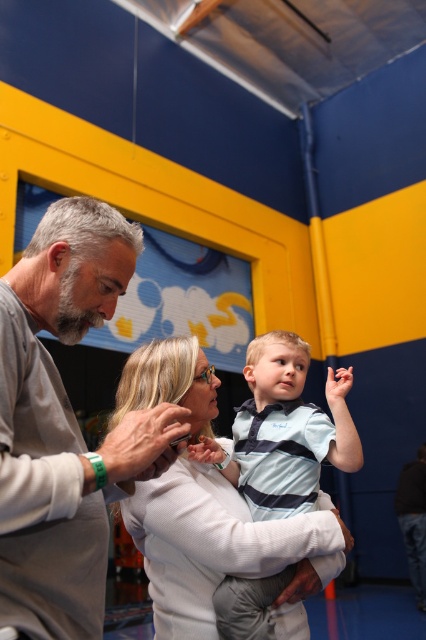
In the scene shown: You are standing in the gymnasium and want to take a photo of the point at coordinates (77, 321). Your camera has a focal length of 50mm and you need to ensure the subject is in focus. What is the minimum distance you should be from the point to capture it clearly?

The point at coordinates (77, 321) is 1.06 meters from the camera. To capture it clearly, you should be at least 1.06 meters away from the point.

You are a photographer trying to capture a group photo of the gray matte shirt at center and the white textured shirt at center. Since you want to frame them properly, can you tell which one is positioned to the left?

The gray matte shirt at center is positioned to the left of the white textured shirt at center.

You are designing a clothing display in a store and need to arrange two shirts from the image. The gray matte shirt at center and the white textured shirt at center. Which shirt should you place on the narrower hanger to ensure it fits properly?

The gray matte shirt at center has a smaller width than the white textured shirt at center, so it should be placed on the narrower hanger to fit properly.